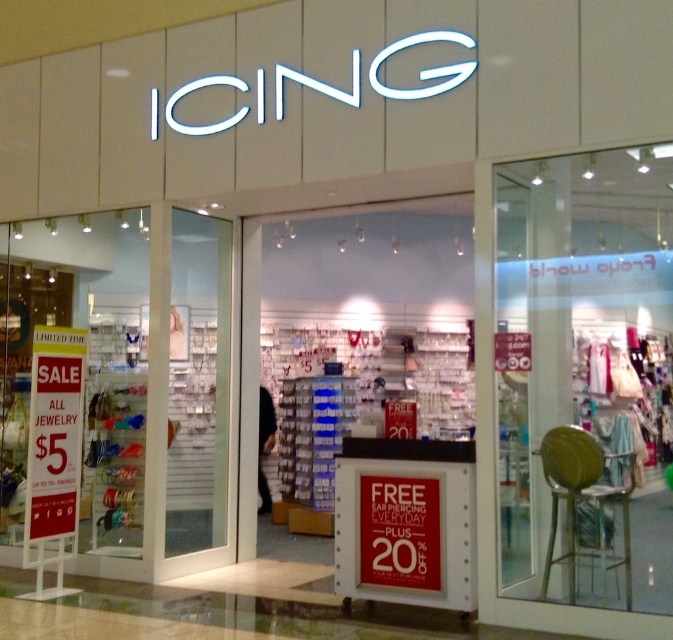
Is transparent glass door at center smaller than white paper sign at left?

No, transparent glass door at center is not smaller than white paper sign at left.

Is transparent glass door at center bigger than white paper sign at left?

Correct, transparent glass door at center is larger in size than white paper sign at left.

Describe the element at coordinates (199, 384) in the screenshot. I see `transparent glass door at center` at that location.

Identify the location of transparent glass door at center. (199, 384).

Is transparent plastic stool at right in front of white paper sign at left?

Yes.

Who is more distant from viewer, [571,314] or [79,477]?

Positioned behind is point [79,477].

Identify the location of transparent plastic stool at right. (583, 374).

Does transparent plastic stool at right have a larger size compared to white paper sign at center?

Yes.

Is transparent plastic stool at right taller than white paper sign at center?

Yes.

Identify the location of transparent plastic stool at right. The width and height of the screenshot is (673, 640). (583, 374).